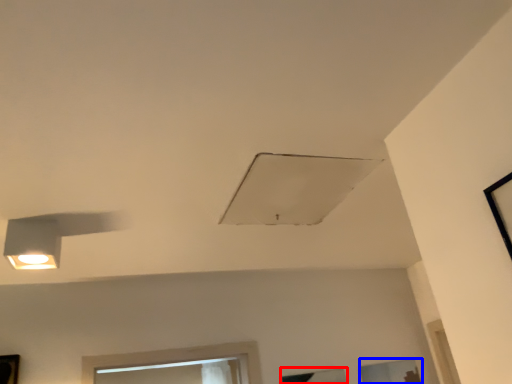
Question: Among these objects, which one is farthest to the camera, window (highlighted by a red box) or window (highlighted by a blue box)?

Choices:
 (A) window
 (B) window

Answer: (B)